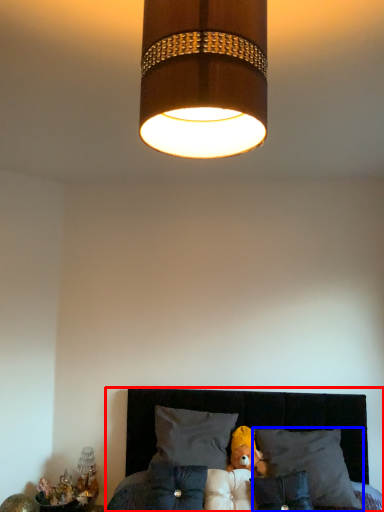
Question: Which object appears closest to the camera in this image, furniture (highlighted by a red box) or pillow (highlighted by a blue box)?

Choices:
 (A) furniture
 (B) pillow

Answer: (A)